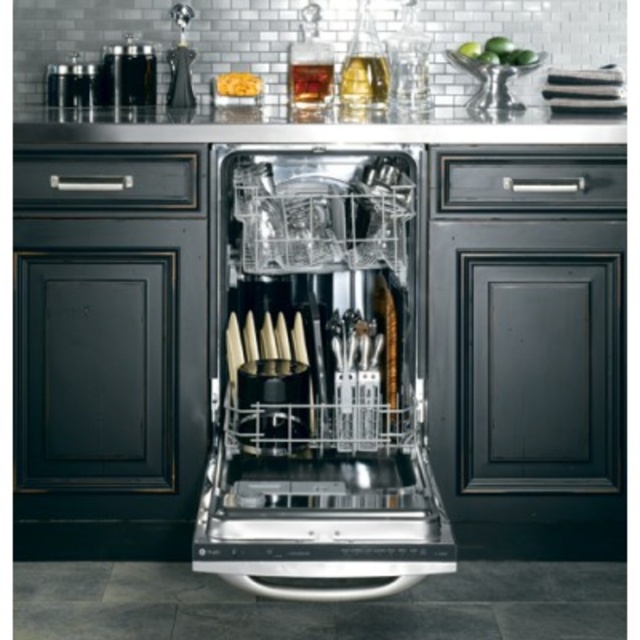
Is satin steel dishwasher at center shorter than satin nickel salt and pepper shakers at left?

In fact, satin steel dishwasher at center may be taller than satin nickel salt and pepper shakers at left.

Describe the element at coordinates (317, 380) in the screenshot. I see `satin steel dishwasher at center` at that location.

You are a GUI agent. You are given a task and a screenshot of the screen. Output one action in this format:
    pyautogui.click(x=<x>, y=<y>)
    Task: Click on the satin steel dishwasher at center
    
    Given the screenshot: What is the action you would take?
    (317, 380)

Who is more distant from viewer, (538, 115) or (72, 83)?

The point (72, 83) is more distant.

Does satin steel countertop at upper center have a greater height compared to satin nickel salt and pepper shakers at left?

Yes.

Between point (280, 116) and point (64, 77), which one is positioned in front?

Point (280, 116) is more forward.

Where is `satin steel countertop at upper center`? The image size is (640, 640). satin steel countertop at upper center is located at coordinates (304, 125).

Is satin steel dishwasher at center thinner than satin steel countertop at upper center?

Correct, satin steel dishwasher at center's width is less than satin steel countertop at upper center's.

Which is in front, point (400, 480) or point (563, 138)?

Positioned in front is point (400, 480).

Where is `satin steel dishwasher at center`? This screenshot has height=640, width=640. satin steel dishwasher at center is located at coordinates (317, 380).